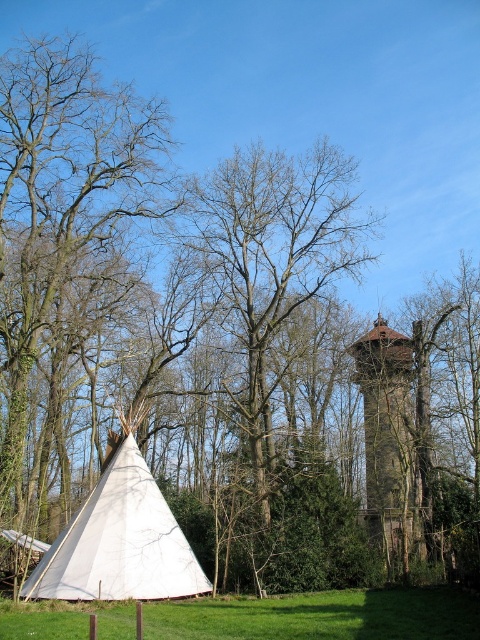
You are planning to hang a large birdhouse on the tree with the most space. Which tree should you choose between the smooth bark tree at left and the bare wood tree at center?

The smooth bark tree at left is larger in size than the bare wood tree at center, so you should choose the smooth bark tree at left because it has more space for the large birdhouse.

You are setting up a picnic blanket near the white canvas tent at lower left and the smooth bark tree at left. If you want to ensure the tree doesn not cast a shadow over your picnic area, which direction should you place your blanket relative to the tree?

Since the smooth bark tree at left is taller than the white canvas tent at lower left, placing the picnic blanket to the east of the tree would keep it out of the shadow during the morning, while placing it to the west would avoid the afternoon shadow. Alternatively, positioning it directly south might minimize shadow coverage depending on the time of day.

You are a hiker trying to determine the best path through the trees. You notice the smooth bark tree at left and the bare wood tree at center. Which tree has a wider trunk?

The smooth bark tree at left might be wider than the bare wood tree at center according to the description.